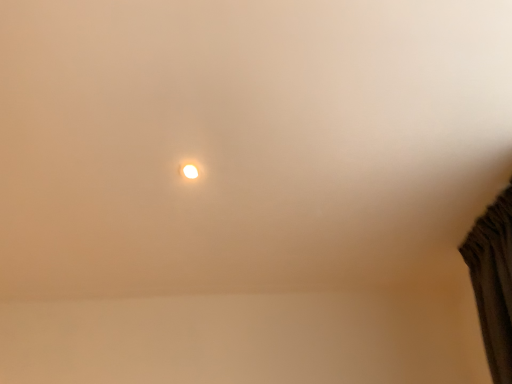
This screenshot has height=384, width=512. What do you see at coordinates (189, 170) in the screenshot?
I see `matte white droplight at upper center` at bounding box center [189, 170].

Locate an element on the screen. The height and width of the screenshot is (384, 512). matte white droplight at upper center is located at coordinates tap(189, 170).

Based on the photo, what is the approximate width of matte white droplight at upper center?

matte white droplight at upper center is 4.25 inches wide.

The height and width of the screenshot is (384, 512). I want to click on matte white droplight at upper center, so tap(189, 170).